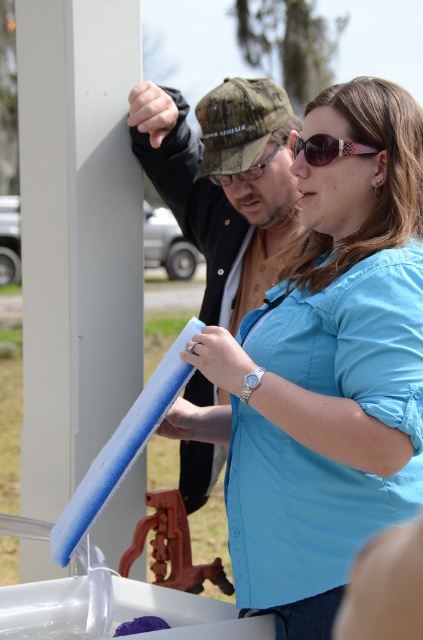
Is point (332, 579) closer to viewer compared to point (299, 136)?

Yes.

Does blue fabric at center have a smaller size compared to purple shiny sunglasses at center?

No, blue fabric at center is not smaller than purple shiny sunglasses at center.

Where is `blue fabric at center`? The height and width of the screenshot is (640, 423). blue fabric at center is located at coordinates (326, 371).

You are a GUI agent. You are given a task and a screenshot of the screen. Output one action in this format:
    pyautogui.click(x=<x>, y=<y>)
    Task: Click on the blue fabric at center
    This screenshot has height=640, width=423.
    Given the screenshot: What is the action you would take?
    pyautogui.click(x=326, y=371)

Is purple shiny sunglasses at center smaller than matte black goggles at center?

Yes.

Which is below, purple shiny sunglasses at center or matte black goggles at center?

Positioned lower is purple shiny sunglasses at center.

What are the coordinates of `purple shiny sunglasses at center` in the screenshot? It's located at (329, 148).

What are the coordinates of `purple shiny sunglasses at center` in the screenshot? It's located at (329, 148).

Who is more distant from viewer, (244, 129) or (324, 156)?

The point (244, 129) is behind.

Is point (208, 205) positioned behind point (340, 148)?

Yes, it is behind point (340, 148).

Image resolution: width=423 pixels, height=640 pixels. In order to click on matte blue foam at center in this screenshot , I will do `click(225, 186)`.